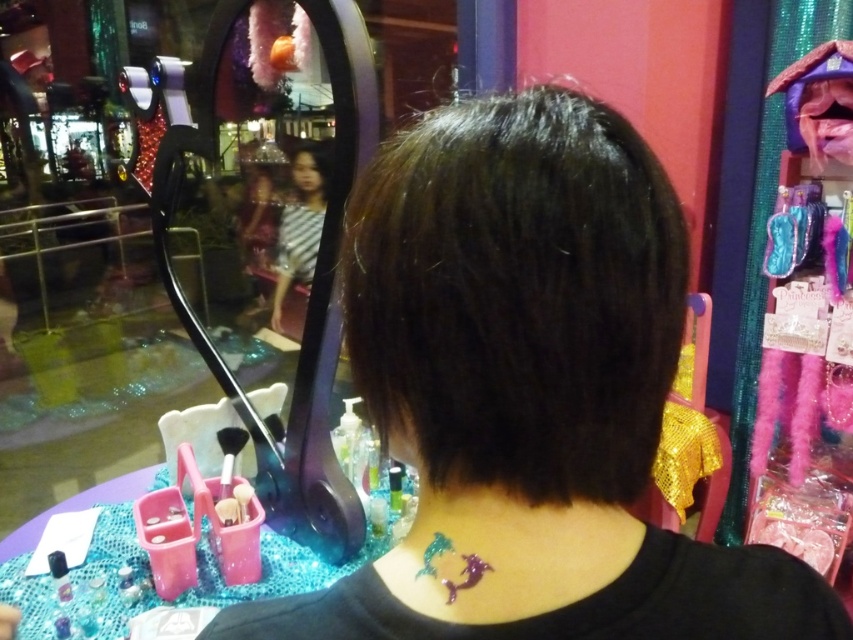
The height and width of the screenshot is (640, 853). Find the location of `dark shiny hair at center`. dark shiny hair at center is located at coordinates (518, 294).

Locate an element on the screen. The image size is (853, 640). dark shiny hair at center is located at coordinates point(518,294).

Between shiny black hair at center and shiny glittery mermaid at center, which one has more height?

shiny black hair at center

Based on the photo, does shiny black hair at center come in front of shiny glittery mermaid at center?

Yes, it is.

Which is in front, point (379, 248) or point (488, 502)?

Point (379, 248) is in front.

I want to click on shiny black hair at center, so click(529, 392).

Can you confirm if dark shiny hair at center is thinner than metallic purple mermaid at center back?

In fact, dark shiny hair at center might be wider than metallic purple mermaid at center back.

Between dark shiny hair at center and metallic purple mermaid at center back, which one is positioned lower?

metallic purple mermaid at center back is below.

Is point (456, 348) farther from viewer compared to point (416, 577)?

No, (456, 348) is in front of (416, 577).

Where is `dark shiny hair at center`? dark shiny hair at center is located at coordinates (518, 294).